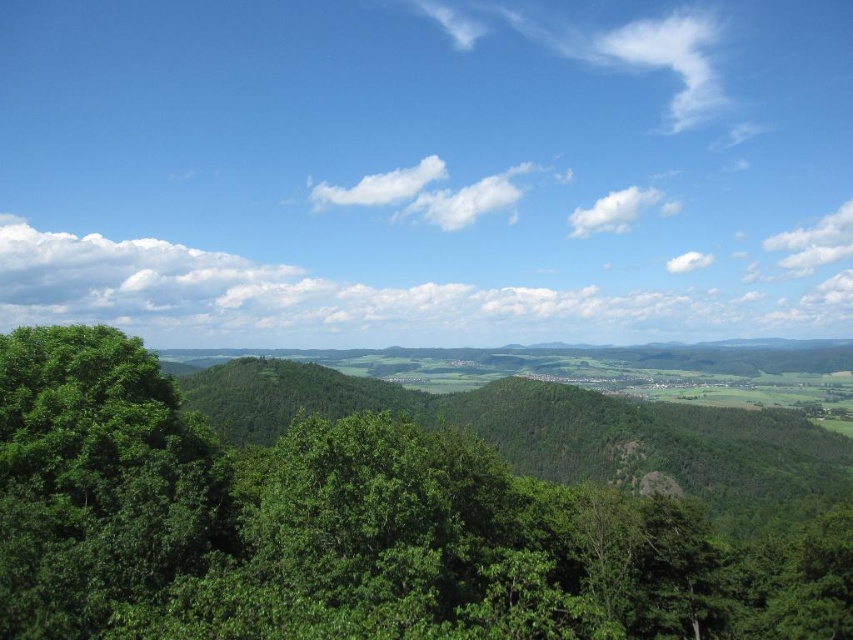
This screenshot has height=640, width=853. What do you see at coordinates (346, 529) in the screenshot?
I see `green leafy tree at center` at bounding box center [346, 529].

Find the location of `green leafy tree at center`. green leafy tree at center is located at coordinates (346, 529).